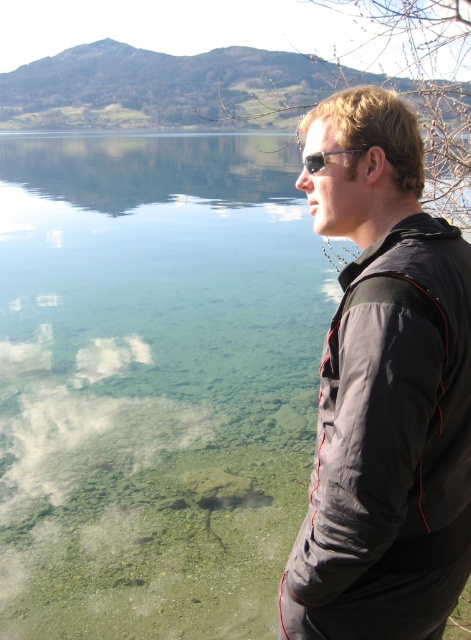
Does dark gray jacket at right appear over sunglasses at center?

Incorrect, dark gray jacket at right is not positioned above sunglasses at center.

Is dark gray jacket at right to the right of sunglasses at center from the viewer's perspective?

Yes, dark gray jacket at right is to the right of sunglasses at center.

The width and height of the screenshot is (471, 640). I want to click on dark gray jacket at right, so click(383, 392).